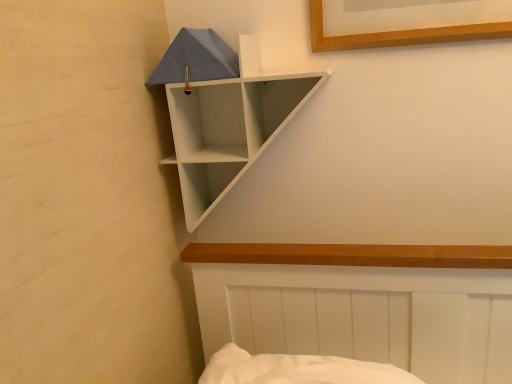
In order to face white matte shelf at upper center, should I rotate leftwards or rightwards?

You should look left and rotate roughly 1.315 degrees.

What is the approximate height of white matte shelf at upper center?

white matte shelf at upper center is 16.35 inches tall.

The width and height of the screenshot is (512, 384). What do you see at coordinates (230, 126) in the screenshot? I see `white matte shelf at upper center` at bounding box center [230, 126].

Where is `white matte shelf at upper center`? This screenshot has height=384, width=512. white matte shelf at upper center is located at coordinates pos(230,126).

You are a GUI agent. You are given a task and a screenshot of the screen. Output one action in this format:
    pyautogui.click(x=<x>, y=<y>)
    Task: Click on the white matte shelf at upper center
    
    Given the screenshot: What is the action you would take?
    pyautogui.click(x=230, y=126)